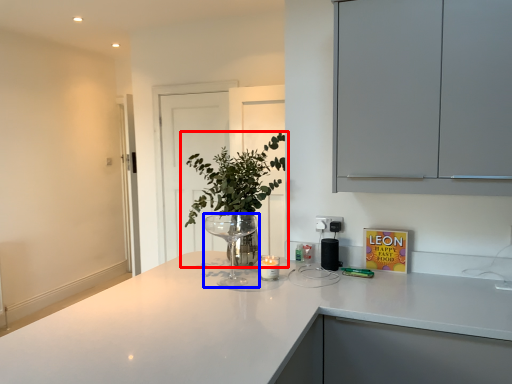
Question: Which object appears closest to the camera in this image, houseplant (highlighted by a red box) or wine glass (highlighted by a blue box)?

Choices:
 (A) houseplant
 (B) wine glass

Answer: (B)